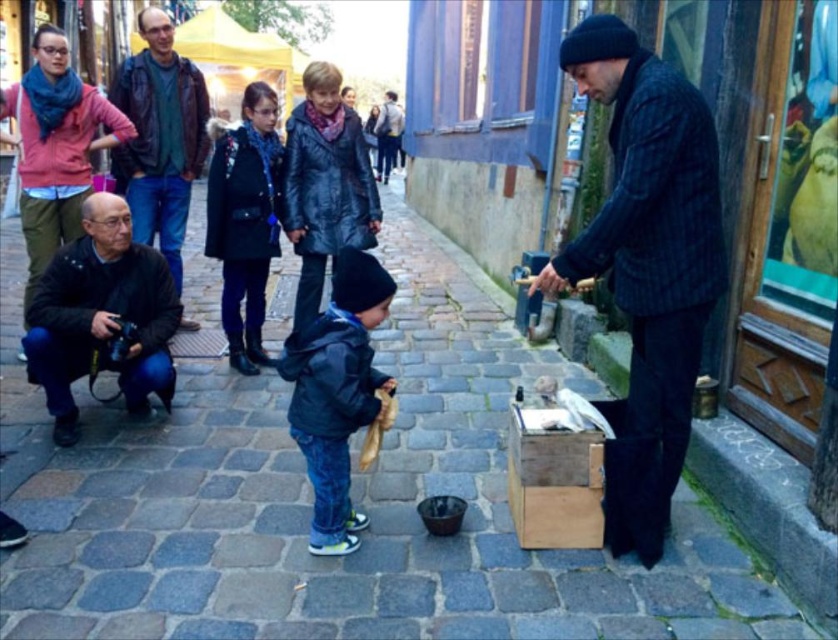
You are a photographer standing in the middle of the alleyway. You want to take a photo that includes both the man and the child. The man is at point (x=185, y=289) and the child is at point (x=591, y=24). Which of them is closer to you so that you can focus on them first?

The man at point (x=185, y=289) is closer to you than the child at point (x=591, y=24), so you should focus on the man first.

You are a street performer standing on the smooth cobblestone pavement at center. You want to place your dark blue denim jacket at center on the ground next to you. Can you tell me if the jacket will rest on the ground or hang over the edge of the pavement?

The smooth cobblestone pavement at center has a lesser height compared to dark blue denim jacket at center, so the jacket will hang over the edge of the pavement.